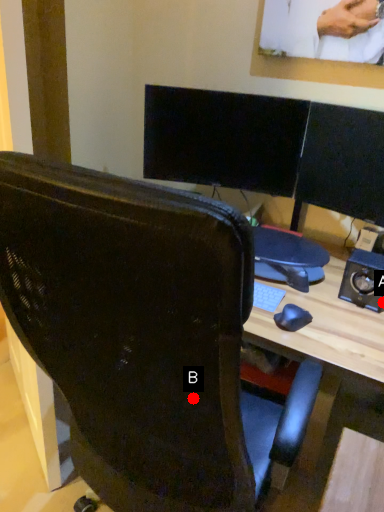
Question: Two points are circled on the image, labeled by A and B beside each circle. Which point is further to the camera?

Choices:
 (A) A is further
 (B) B is further

Answer: (A)